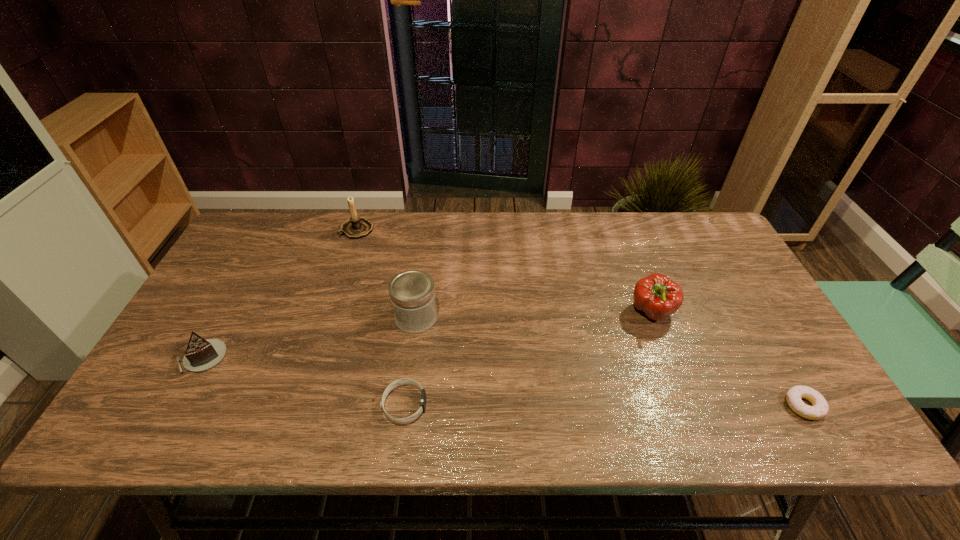
In the image, there is a desktop. Identify the location of free region at the far edge. The height and width of the screenshot is (540, 960). (518, 217).

In the image, there is a desktop. Identify the location of free space at the near edge. (378, 436).

Where is `vacant position at the left edge of the desktop`? The width and height of the screenshot is (960, 540). vacant position at the left edge of the desktop is located at coordinates (243, 291).

In order to click on vacant region at the right edge of the desktop in this screenshot , I will do `click(718, 279)`.

In the image, there is a desktop. Identify the location of vacant space at the far right corner. This screenshot has height=540, width=960. (685, 221).

I want to click on vacant area at the near right corner of the desktop, so click(830, 425).

The height and width of the screenshot is (540, 960). In order to click on vacant area that lies between the fourth farthest object and the second object from left to right in this screenshot , I will do coord(279,293).

The image size is (960, 540). I want to click on vacant area that lies between the farthest object and the fifth tallest object, so coord(381,317).

Where is `vacant region between the fourth tallest object and the pepper`? This screenshot has width=960, height=540. vacant region between the fourth tallest object and the pepper is located at coordinates (427, 335).

This screenshot has height=540, width=960. Identify the location of vacant space that's between the candle holder and the wristband. (381, 317).